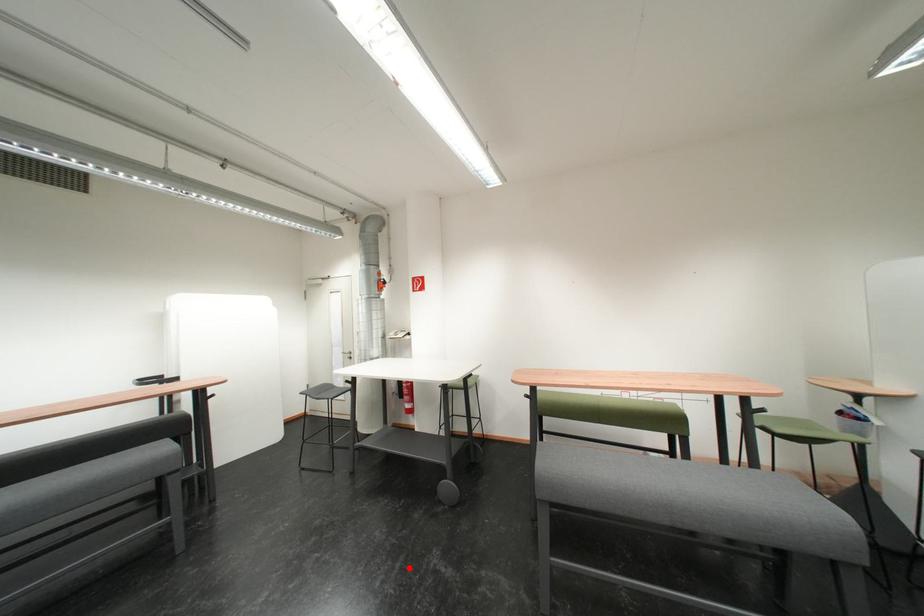
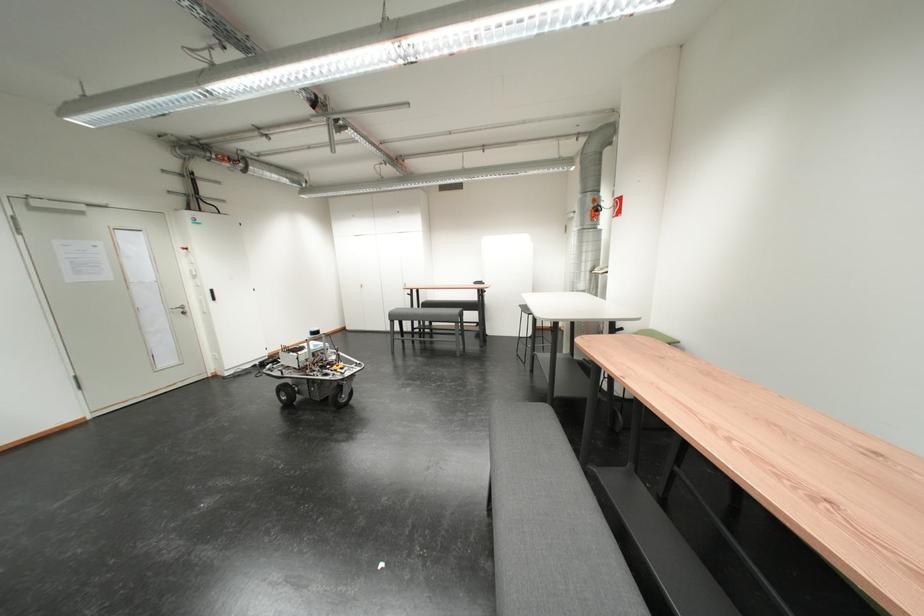
In the second image, find the point that corresponds to the highlighted location in the first image.

(494, 419)